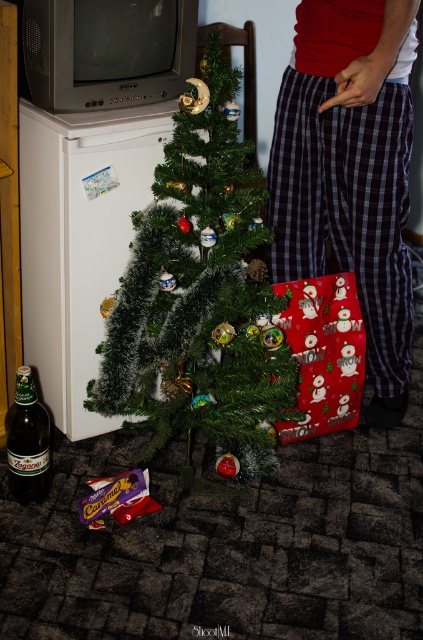
Question: Does green matte christmas tree at center appear under plaid cotton pants at center?

Choices:
 (A) yes
 (B) no

Answer: (A)

Question: From the image, what is the correct spatial relationship of green matte christmas tree at center in relation to plaid cotton pants at center?

Choices:
 (A) right
 (B) left

Answer: (B)

Question: Among these points, which one is nearest to the camera?

Choices:
 (A) (43, 445)
 (B) (186, 308)

Answer: (B)

Question: Which of the following is the closest to the observer?

Choices:
 (A) green matte christmas tree at center
 (B) brown glass bottle at lower left

Answer: (A)

Question: Which of these objects is positioned farthest from the plaid cotton pants at center?

Choices:
 (A) brown glass bottle at lower left
 (B) green matte christmas tree at center

Answer: (A)

Question: Can you confirm if plaid cotton pants at center is smaller than brown glass bottle at lower left?

Choices:
 (A) yes
 (B) no

Answer: (B)